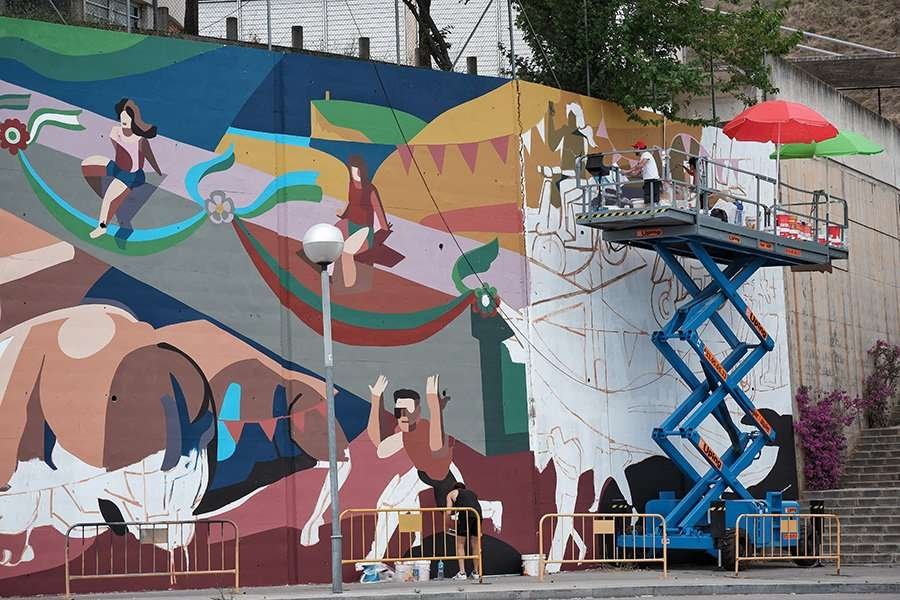
The height and width of the screenshot is (600, 900). In order to click on dark red paint in this screenshot , I will do `click(41, 591)`.